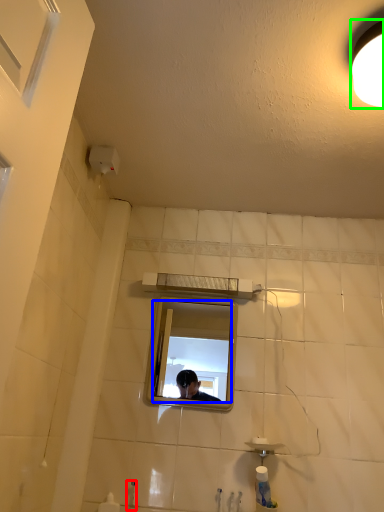
Question: Which object is positioned farthest from faucet (highlighted by a red box)? Select from mirror (highlighted by a blue box) and light fixture (highlighted by a green box).

Choices:
 (A) mirror
 (B) light fixture

Answer: (A)